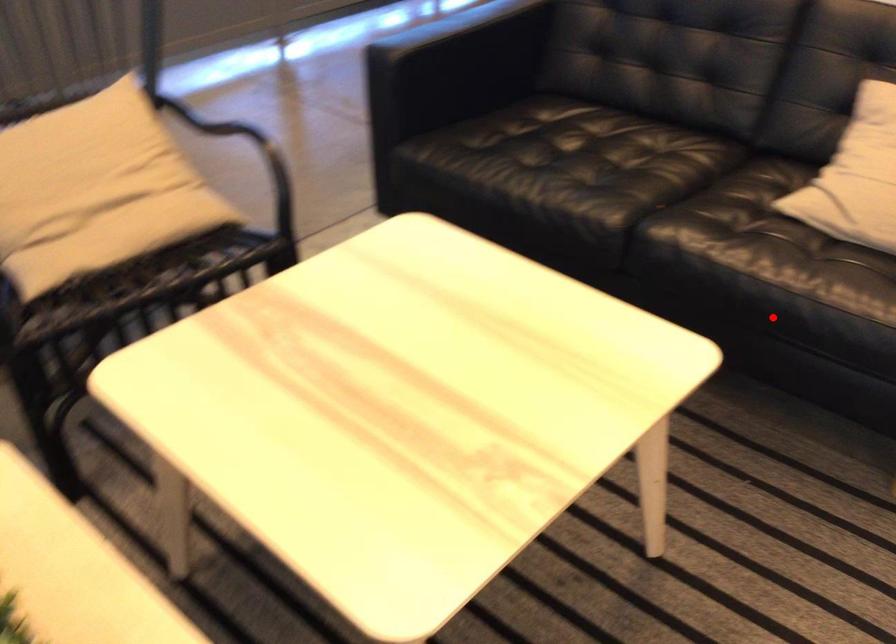
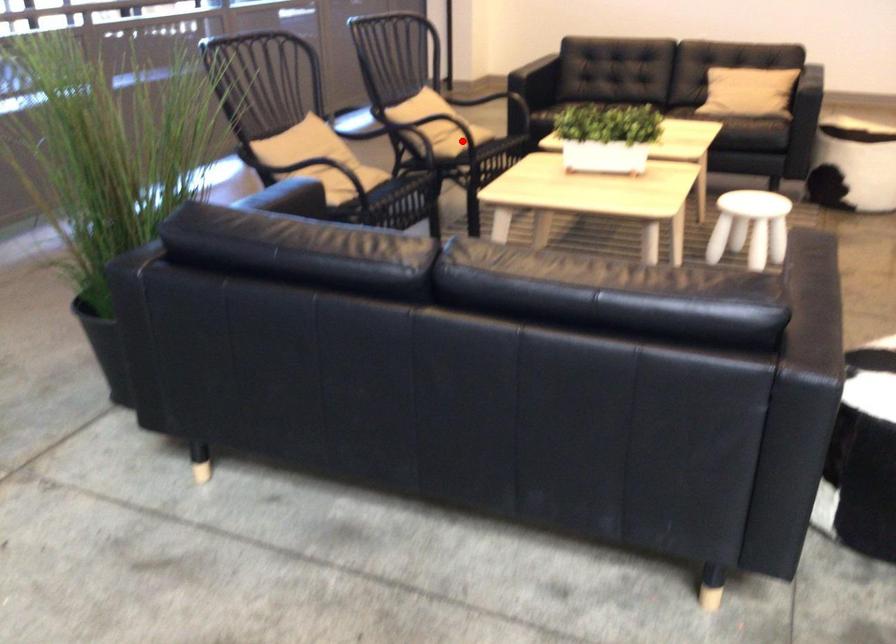
I am providing you with two images of the same scene from different viewpoints. A red point is marked on the first image and another point is marked on the second image. Are the points marked in image1 and image2 representing the same 3D position?

No